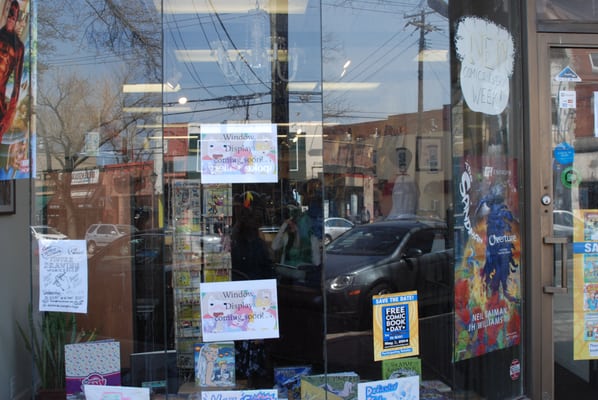
You are a GUI agent. You are given a task and a screenshot of the screen. Output one action in this format:
    pyautogui.click(x=<x>, y=<y>)
    Task: Click on the sticker
    This screenshot has height=400, width=598.
    Given the screenshot: What is the action you would take?
    pyautogui.click(x=570, y=73), pyautogui.click(x=566, y=95), pyautogui.click(x=560, y=149), pyautogui.click(x=570, y=179), pyautogui.click(x=512, y=377)